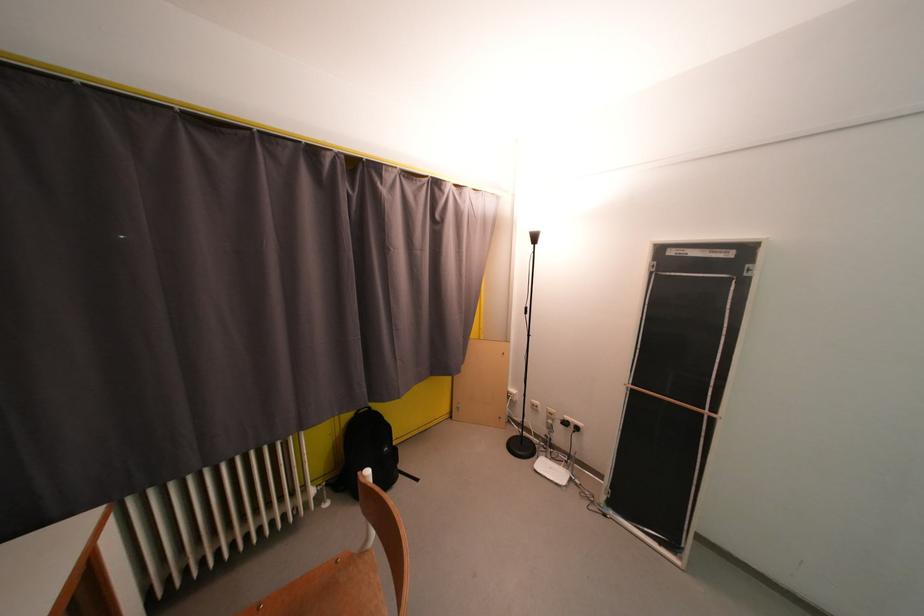
This screenshot has height=616, width=924. Describe the element at coordinates (526, 312) in the screenshot. I see `a lamp switch` at that location.